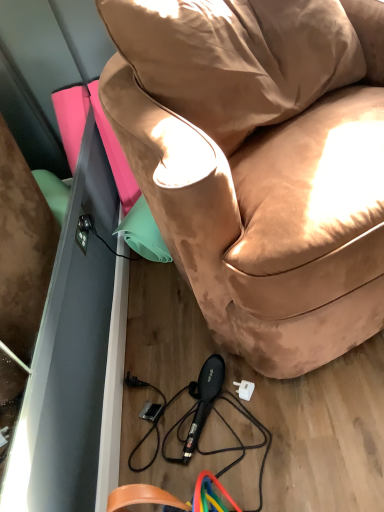
Locate an element on the screen. suede-like tan chair at center is located at coordinates (257, 167).

The image size is (384, 512). What do you see at coordinates (257, 167) in the screenshot? I see `suede-like tan chair at center` at bounding box center [257, 167].

I want to click on suede-like tan chair at center, so click(257, 167).